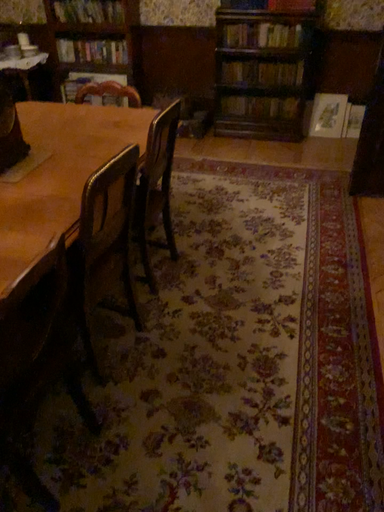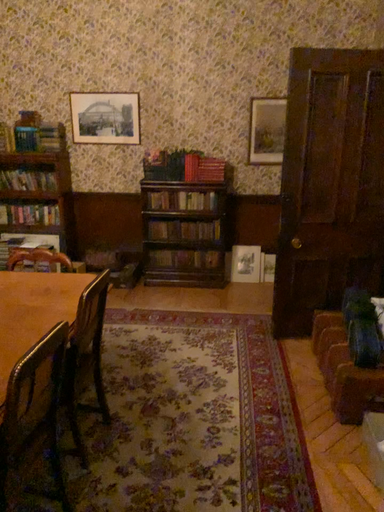
Question: Which way did the camera rotate in the video?

Choices:
 (A) rotated downward
 (B) rotated upward

Answer: (B)